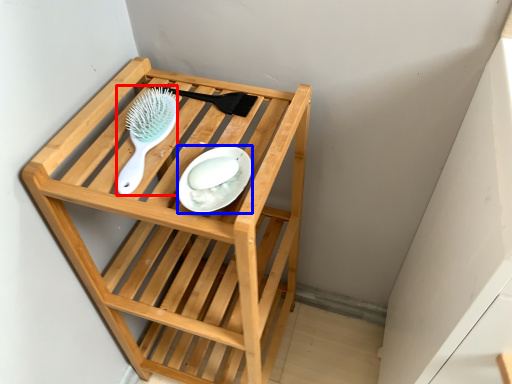
Question: Which of the following is the closest to the observer, brush (highlighted by a red box) or plate (highlighted by a blue box)?

Choices:
 (A) brush
 (B) plate

Answer: (B)